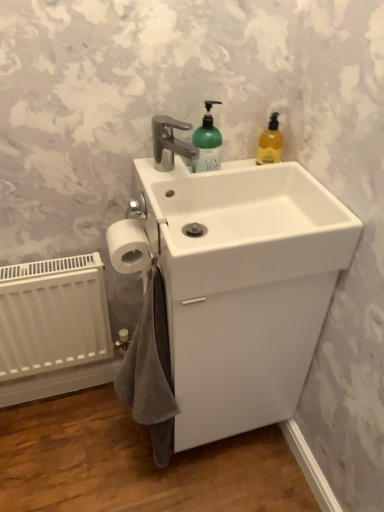
Locate an element on the screen. This screenshot has width=384, height=512. vacant area that lies in front of gray cotton bath towel at lower left is located at coordinates (147, 490).